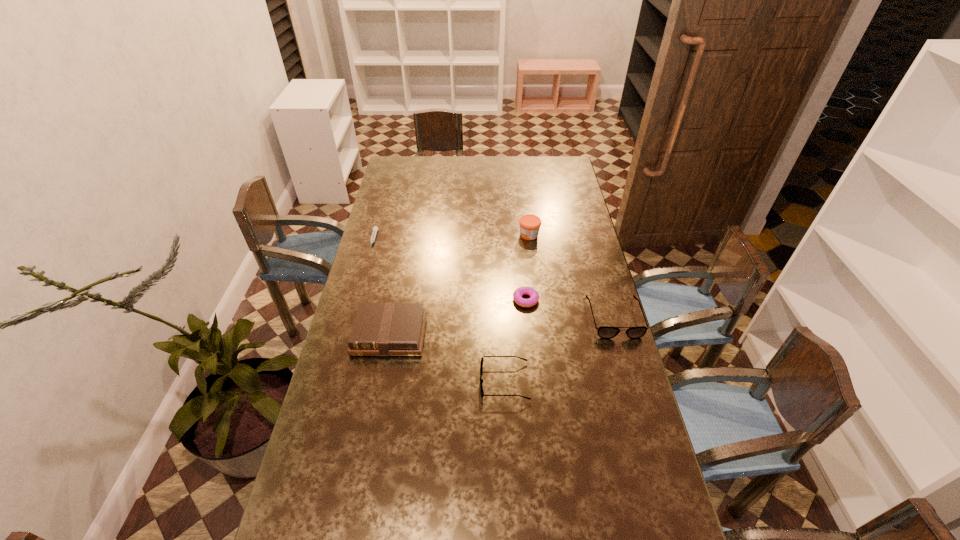
You are a GUI agent. You are given a task and a screenshot of the screen. Output one action in this format:
    pyautogui.click(x=<x>, y=<y>)
    Task: Click on the free spot that satisfies the following two spatial constraints: 1. on the front label of the tallest object; 2. at the needle end of the leftmost object
    The width and height of the screenshot is (960, 540).
    Given the screenshot: What is the action you would take?
    pyautogui.click(x=530, y=240)

At what (x,y) coordinates should I click in order to perform the action: click on vacant space that satisfies the following two spatial constraints: 1. on the front side of the doughnut; 2. on the front-facing side of the shorter spectacles. Please return your answer as a coordinate pair (x, y). The image size is (960, 540). Looking at the image, I should click on (534, 381).